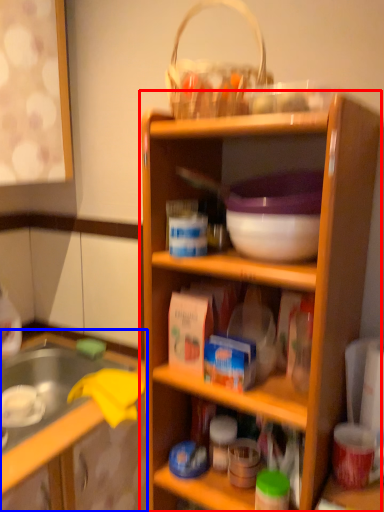
Question: Which object is closer to the camera taking this photo, shelf (highlighted by a red box) or cabinetry (highlighted by a blue box)?

Choices:
 (A) shelf
 (B) cabinetry

Answer: (A)